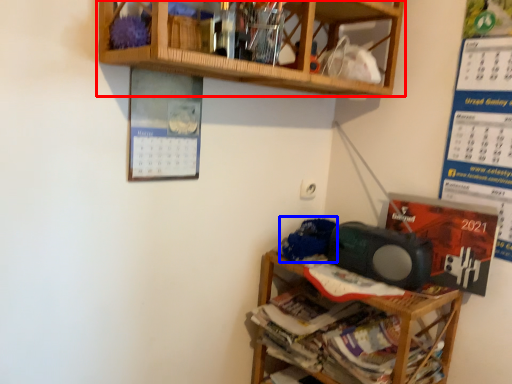
Question: Which of the following is the farthest to the observer, shelf (highlighted by a red box) or waste (highlighted by a blue box)?

Choices:
 (A) shelf
 (B) waste

Answer: (B)